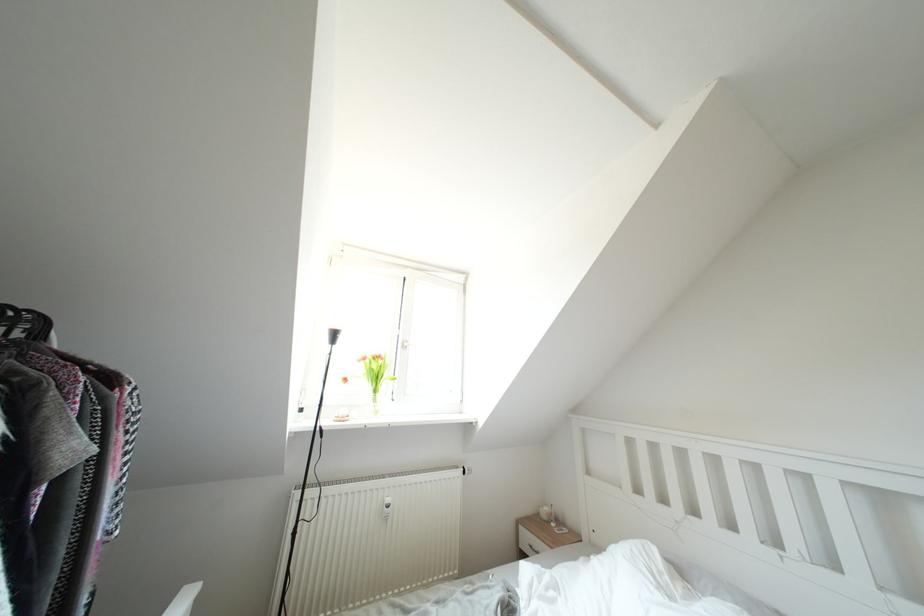
Identify the location of radiator thermostat knob. The height and width of the screenshot is (616, 924). (386, 509).